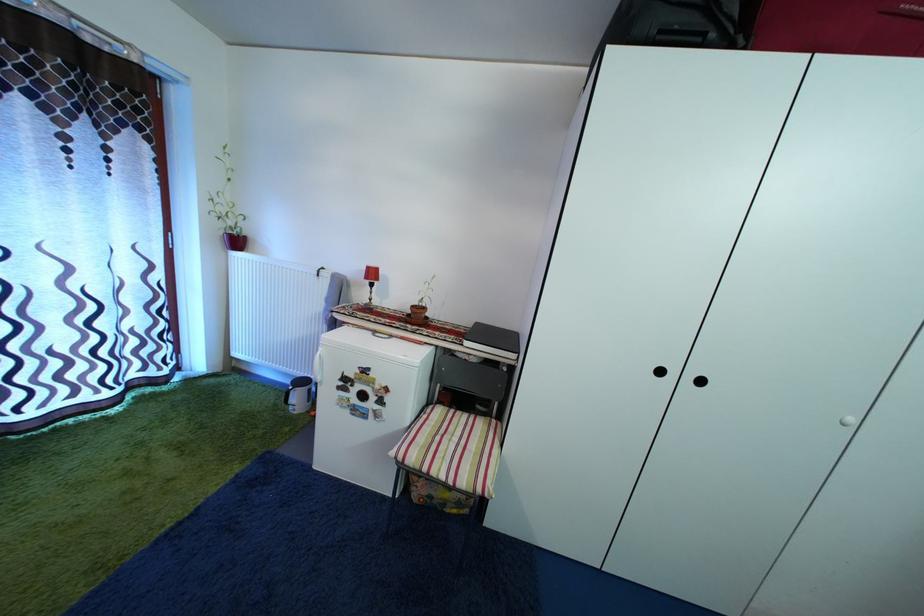
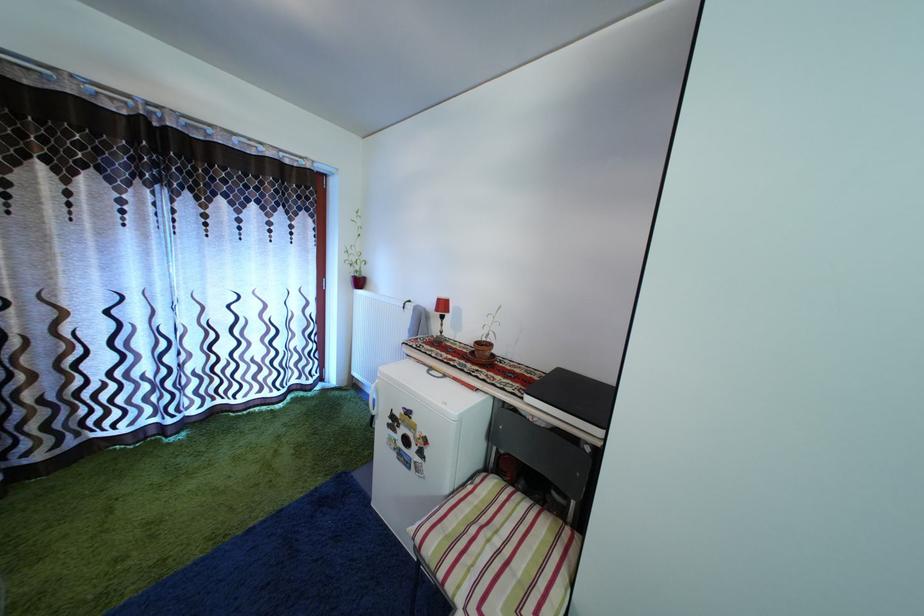
In the second image, find the point that corresponds to point 464,447 in the first image.

(505, 549)